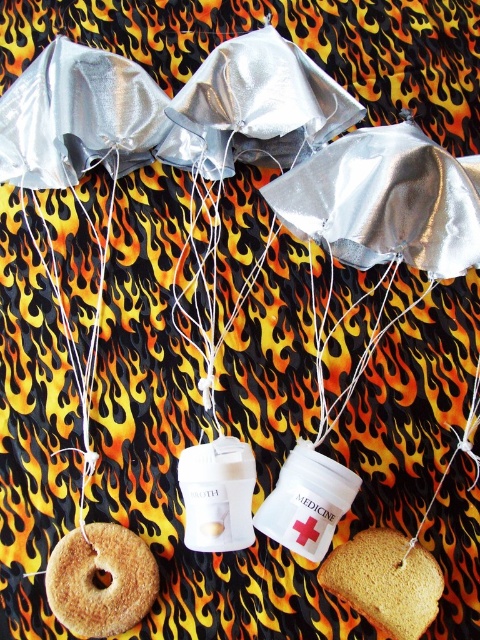
You are a chef trying to retrieve the golden brown bread at lower right from the scene. However, there is a white string at center in your path. Can you reach the bread without touching the string?

The golden brown bread at lower right is in front of the white string at center, so you can reach it without touching the string by going around or under the string.

You are standing in front of the image and see two points labeled as point A and point B. Point A has coordinates point A at [137,554] and point B at [87,422]. Which point is closer to you?

Point A at [137,554] is closer to the viewer than point B at [87,422].

You are a baker who needs to determine which item is wider between the brown crumbly pastry at lower left and the white string at center. Which one is wider?

The brown crumbly pastry at lower left is wider than the white string at center.